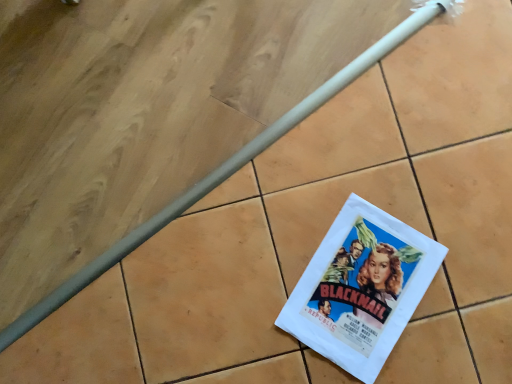
Locate an element on the screen. white paper poster at center is located at coordinates (361, 288).

This screenshot has width=512, height=384. Describe the element at coordinates (361, 288) in the screenshot. I see `white paper poster at center` at that location.

Where is `white paper poster at center`? white paper poster at center is located at coordinates (361, 288).